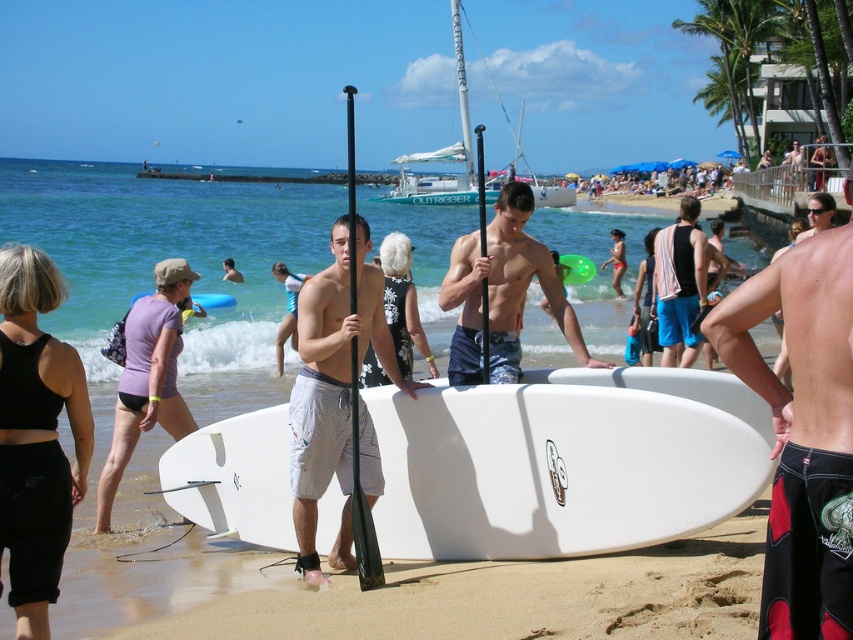
You are a photographer trying to capture a closeup of the shorts worn by the people in the beach scene. Since you want to focus on the details of the fabric, you need to know which shorts are narrower. Which one is thinner between the matte blue shorts at center and the blue denim shorts at center?

The matte blue shorts at center are thinner than the blue denim shorts at center according to the description.

You are a photographer trying to capture a clear shot of the white smooth surfboard at center without any obstruction. Since the white mesh shorts at center might be in the way, can you determine if the surfboard is visible behind the shorts?

The white smooth surfboard at center is positioned under the white mesh shorts at center, so it is likely visible behind them as the shorts are mesh and may allow some transparency, but there might be partial obstruction depending on the angle and lighting.

You are a photographer trying to capture a photo of the beach scene. You notice two points marked in the image. Which point, point 1 at coordinates point [668,472] or point 2 at coordinates point [302,497], is closer to your camera lens?

Point 1 at coordinates point [668,472] is closer to the camera lens than point 2 at coordinates point [302,497].